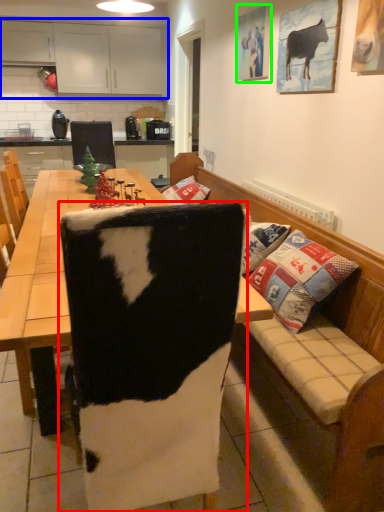
Question: Which object is the closest to the chair (highlighted by a red box)? Choose among these: cabinetry (highlighted by a blue box) or picture frame (highlighted by a green box).

Choices:
 (A) cabinetry
 (B) picture frame

Answer: (B)